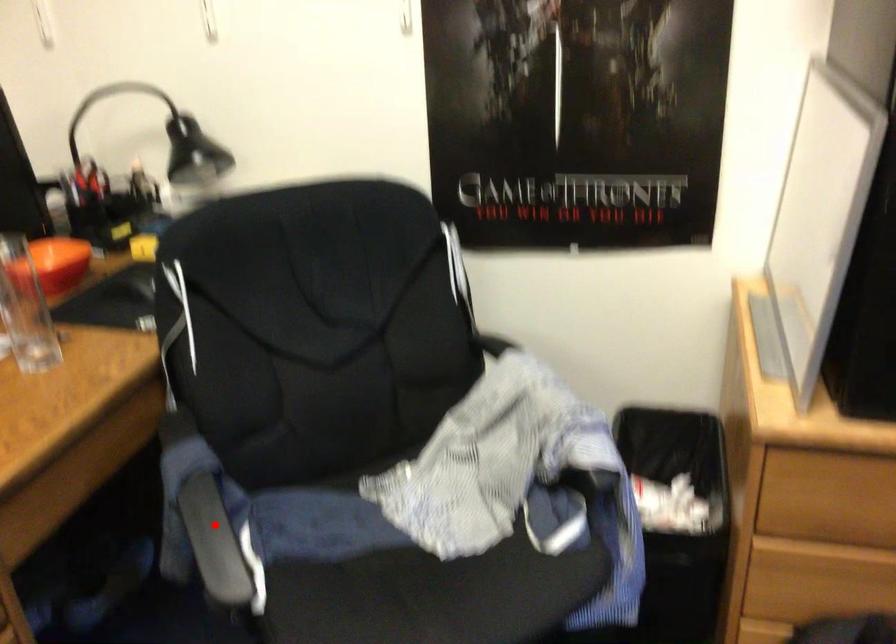
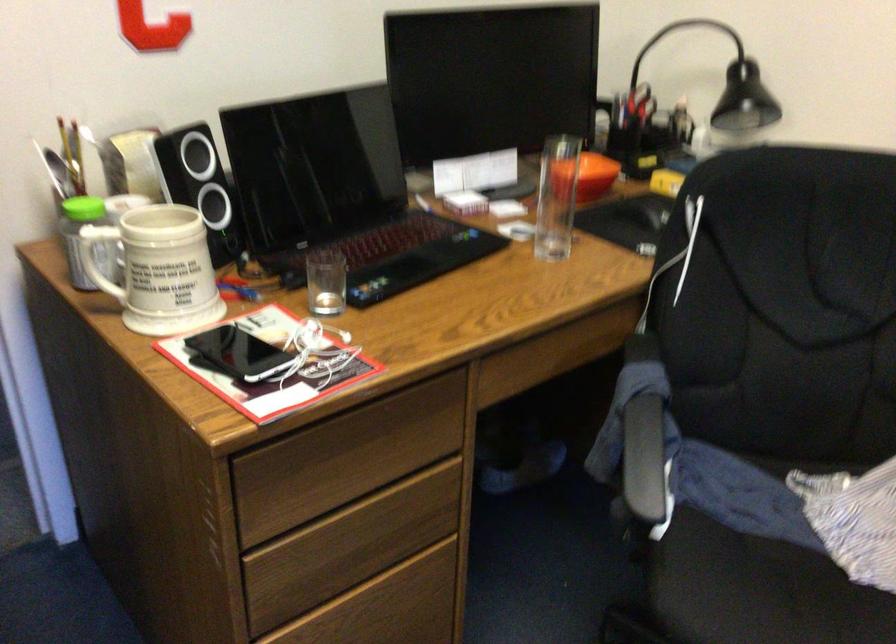
Locate, in the second image, the point that corresponds to the highlighted location in the first image.

(642, 442)